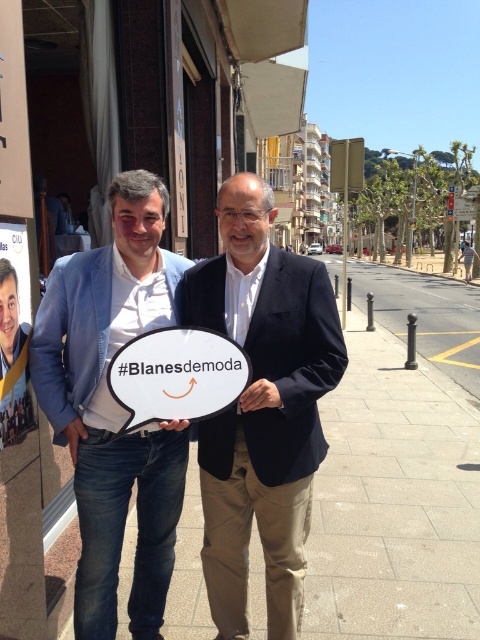
Which is more to the left, white concrete pavement at center or blue denim jeans at lower left?

blue denim jeans at lower left

Which is in front, point (456, 292) or point (84, 344)?

Positioned in front is point (84, 344).

Which is in front, point (471, 305) or point (147, 248)?

Positioned in front is point (147, 248).

Locate an element on the screen. white concrete pavement at center is located at coordinates (397, 474).

Is white concrete pavement at center positioned in front of black matte suit at center?

No, it is not.

Does white concrete pavement at center appear on the left side of black matte suit at center?

Incorrect, white concrete pavement at center is not on the left side of black matte suit at center.

What are the coordinates of `white concrete pavement at center` in the screenshot? It's located at (397, 474).

Locate an element on the screen. white concrete pavement at center is located at coordinates (397, 474).

Is the position of black matte suit at center more distant than that of blue denim jeans at lower left?

Yes, black matte suit at center is behind blue denim jeans at lower left.

Locate an element on the screen. black matte suit at center is located at coordinates (262, 406).

At what (x,y) coordinates should I click in order to perform the action: click on black matte suit at center. Please return your answer as a coordinate pair (x, y). Looking at the image, I should click on (262, 406).